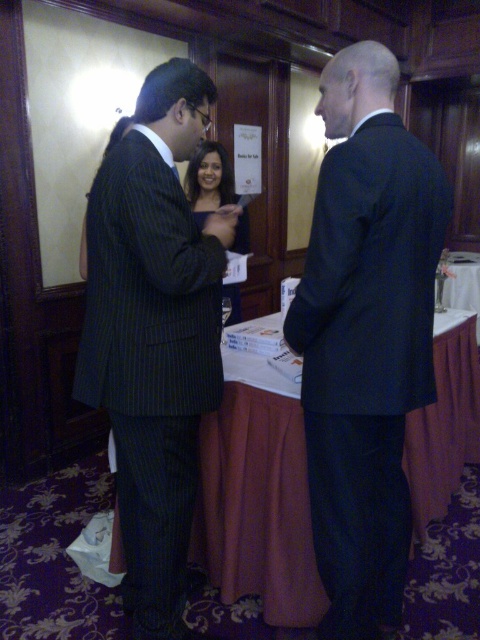
Question: Which object is the closest to the matte black dress at center?

Choices:
 (A) black smooth suit at center
 (B) white paper at center
 (C) dark pinstripe suit at left

Answer: (C)

Question: Among these objects, which one is nearest to the camera?

Choices:
 (A) white paper at center
 (B) black smooth suit at center
 (C) matte black dress at center
 (D) dark pinstripe suit at left

Answer: (B)

Question: Is black smooth suit at center in front of dark pinstripe suit at left?

Choices:
 (A) no
 (B) yes

Answer: (B)

Question: Is dark pinstripe suit at left bigger than white paper at center?

Choices:
 (A) no
 (B) yes

Answer: (B)

Question: Which object is positioned closest to the black smooth suit at center?

Choices:
 (A) white paper at center
 (B) dark pinstripe suit at left
 (C) matte black dress at center

Answer: (B)

Question: Does white paper at center have a larger size compared to matte black dress at center?

Choices:
 (A) yes
 (B) no

Answer: (A)